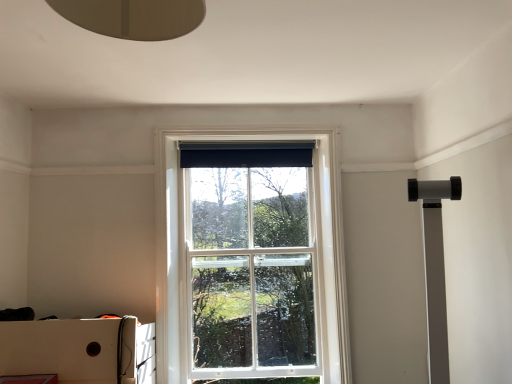
Locate an element on the screen. white glass window at center is located at coordinates (251, 258).

The image size is (512, 384). I want to click on black fabric curtain at upper center, so click(246, 158).

Identify the location of white cardboard box at lower left. The image size is (512, 384). (71, 349).

Would you say white glass window at center is part of white cardboard box at lower left's contents?

No, white glass window at center is not inside white cardboard box at lower left.

From the picture: Which point is more forward, (95, 324) or (244, 316)?

The point (95, 324) is closer to the camera.

Can you confirm if white cardboard box at lower left is shorter than white glass window at center?

Correct, white cardboard box at lower left is not as tall as white glass window at center.

Considering the relative sizes of white cardboard box at lower left and white glass window at center in the image provided, is white cardboard box at lower left bigger than white glass window at center?

Correct, white cardboard box at lower left is larger in size than white glass window at center.

Is white cardboard box at lower left shorter than black fabric curtain at upper center?

No.

Is white cardboard box at lower left placed right next to black fabric curtain at upper center?

No, white cardboard box at lower left is not beside black fabric curtain at upper center.

Between white cardboard box at lower left and black fabric curtain at upper center, which one has smaller width?

Thinner between the two is black fabric curtain at upper center.

Is black fabric curtain at upper center positioned behind white glass window at center?

Yes, it is behind white glass window at center.

Measure the distance from black fabric curtain at upper center to white glass window at center.

A distance of 20.96 inches exists between black fabric curtain at upper center and white glass window at center.

Would you say black fabric curtain at upper center is a long distance from white glass window at center?

No, there isn't a large distance between black fabric curtain at upper center and white glass window at center.

How different are the orientations of black fabric curtain at upper center and white glass window at center in degrees?

1.87 degrees separate the facing orientations of black fabric curtain at upper center and white glass window at center.

Considering the relative sizes of black fabric curtain at upper center and white cardboard box at lower left in the image provided, is black fabric curtain at upper center wider than white cardboard box at lower left?

No, black fabric curtain at upper center is not wider than white cardboard box at lower left.

Is black fabric curtain at upper center aimed at white cardboard box at lower left?

No, black fabric curtain at upper center does not turn towards white cardboard box at lower left.

Considering the positions of objects black fabric curtain at upper center and white cardboard box at lower left in the image provided, who is in front, black fabric curtain at upper center or white cardboard box at lower left?

Positioned in front is white cardboard box at lower left.

How different are the orientations of black fabric curtain at upper center and white cardboard box at lower left in degrees?

The facing directions of black fabric curtain at upper center and white cardboard box at lower left are 1.86 degrees apart.

From the picture: Is black fabric curtain at upper center inside white glass window at center?

Yes, black fabric curtain at upper center can be found within white glass window at center.

Considering the positions of objects white glass window at center and black fabric curtain at upper center in the image provided, who is in front, white glass window at center or black fabric curtain at upper center?

white glass window at center.

Which of these two, white glass window at center or black fabric curtain at upper center, is bigger?

white glass window at center.

Which is farther from the camera, [228,234] or [237,160]?

Positioned behind is point [228,234].

Can you tell me how much white glass window at center and white cardboard box at lower left differ in facing direction?

The facing directions of white glass window at center and white cardboard box at lower left are 0.0129 degrees apart.

From the picture: From the image's perspective, relative to white cardboard box at lower left, is white glass window at center above or below?

white glass window at center is above white cardboard box at lower left.

Is white glass window at center positioned beyond the bounds of white cardboard box at lower left?

white glass window at center is positioned outside white cardboard box at lower left.

At what (x,y) coordinates should I click in order to perform the action: click on window on the right of white cardboard box at lower left. Please return your answer as a coordinate pair (x, y). The image size is (512, 384). Looking at the image, I should click on 251,258.

The width and height of the screenshot is (512, 384). I want to click on curtain above the white cardboard box at lower left (from a real-world perspective), so click(x=246, y=158).

Considering their positions, is black fabric curtain at upper center positioned closer to white cardboard box at lower left than white glass window at center?

white glass window at center is positioned closer to the anchor white cardboard box at lower left.

Looking at this image, estimate the real-world distances between objects in this image. Which object is further from white glass window at center, black fabric curtain at upper center or white cardboard box at lower left?

white cardboard box at lower left is further to white glass window at center.

Looking at the image, which one is located further to black fabric curtain at upper center, white glass window at center or white cardboard box at lower left?

Among the two, white cardboard box at lower left is located further to black fabric curtain at upper center.

Considering their positions, is white cardboard box at lower left positioned closer to white glass window at center than black fabric curtain at upper center?

Based on the image, black fabric curtain at upper center appears to be nearer to white glass window at center.

Looking at the image, which one is located closer to white cardboard box at lower left, white glass window at center or black fabric curtain at upper center?

white glass window at center is closer to white cardboard box at lower left.

Which object lies further to the anchor point black fabric curtain at upper center, white cardboard box at lower left or white glass window at center?

Among the two, white cardboard box at lower left is located further to black fabric curtain at upper center.

In order to click on window between black fabric curtain at upper center and white cardboard box at lower left vertically in this screenshot , I will do [251, 258].